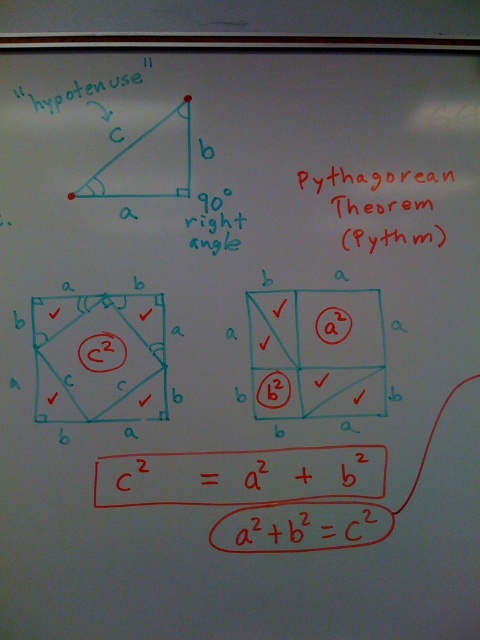
Can you confirm if matte blue square at center is shorter than blue marker text at center?

Incorrect, matte blue square at center's height does not fall short of blue marker text at center's.

Identify the location of matte blue square at center. (99, 356).

Identify the location of matte blue square at center. (99, 356).

Does matte blue square at center have a greater height compared to red matte pythagorean theorem at upper right?

Correct, matte blue square at center is much taller as red matte pythagorean theorem at upper right.

Between matte blue square at center and red matte pythagorean theorem at upper right, which one appears on the left side from the viewer's perspective?

matte blue square at center

Identify the location of matte blue square at center. (99, 356).

Locate an element on the screen. The width and height of the screenshot is (480, 640). matte blue square at center is located at coordinates (99, 356).

Can you confirm if red matte pythagorean theorem at upper right is taller than blue marker text at center?

Yes, red matte pythagorean theorem at upper right is taller than blue marker text at center.

Which of these two, red matte pythagorean theorem at upper right or blue marker text at center, stands taller?

red matte pythagorean theorem at upper right

Does point (372, 211) come farther from viewer compared to point (205, 221)?

Yes, point (372, 211) is behind point (205, 221).

I want to click on red matte pythagorean theorem at upper right, so click(x=377, y=179).